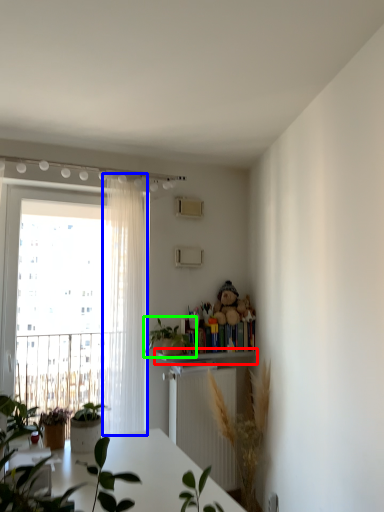
Question: Considering the real-world distances, which object is farthest from shelf (highlighted by a red box)? curtain (highlighted by a blue box) or houseplant (highlighted by a green box)?

Choices:
 (A) curtain
 (B) houseplant

Answer: (A)